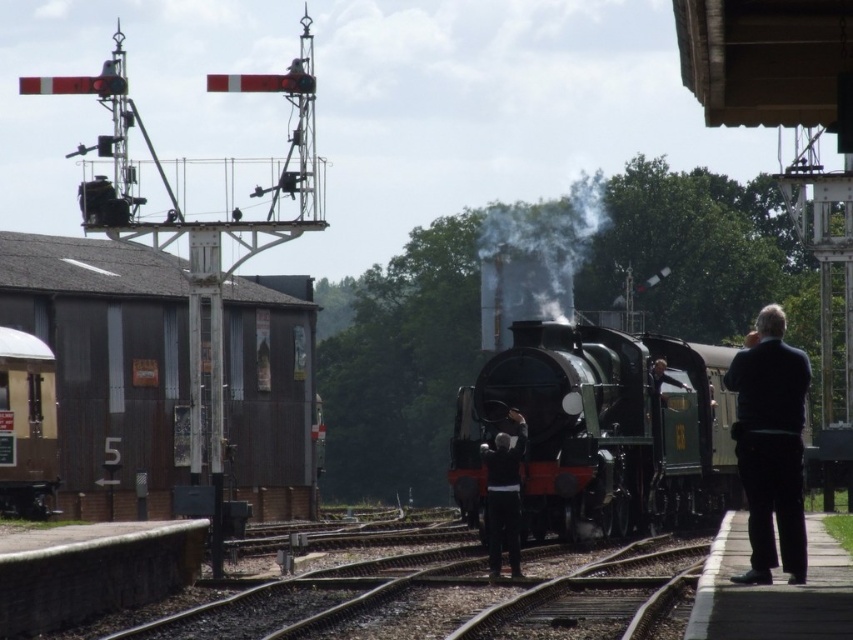
Question: Is shiny black locomotive at center positioned behind brown wooden train at left?

Choices:
 (A) yes
 (B) no

Answer: (B)

Question: Which point is closer to the camera taking this photo?

Choices:
 (A) pos(550,211)
 (B) pos(509,436)

Answer: (B)

Question: Can you confirm if black woolen jacket at right is smaller than brown wooden train at left?

Choices:
 (A) yes
 (B) no

Answer: (B)

Question: Which object is the farthest from the brown wooden train at left?

Choices:
 (A) dark gray sweater at center
 (B) smoke/grey at center

Answer: (B)

Question: Based on their relative distances, which object is farther from the smoke/grey at center?

Choices:
 (A) brown wooden train at left
 (B) rusty metal building at left
 (C) black woolen jacket at right
 (D) dark gray sweater at center

Answer: (D)

Question: Can you confirm if shiny black locomotive at center is positioned below black woolen jacket at right?

Choices:
 (A) yes
 (B) no

Answer: (A)